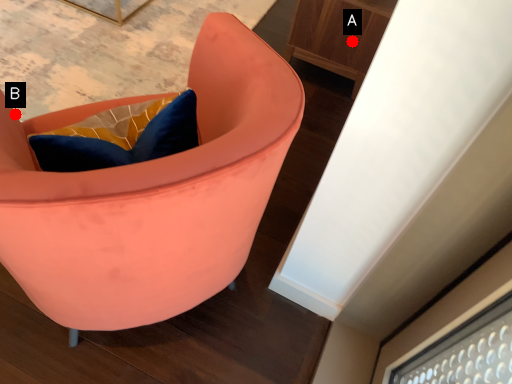
Question: Two points are circled on the image, labeled by A and B beside each circle. Which point appears farthest from the camera in this image?

Choices:
 (A) A is further
 (B) B is further

Answer: (A)